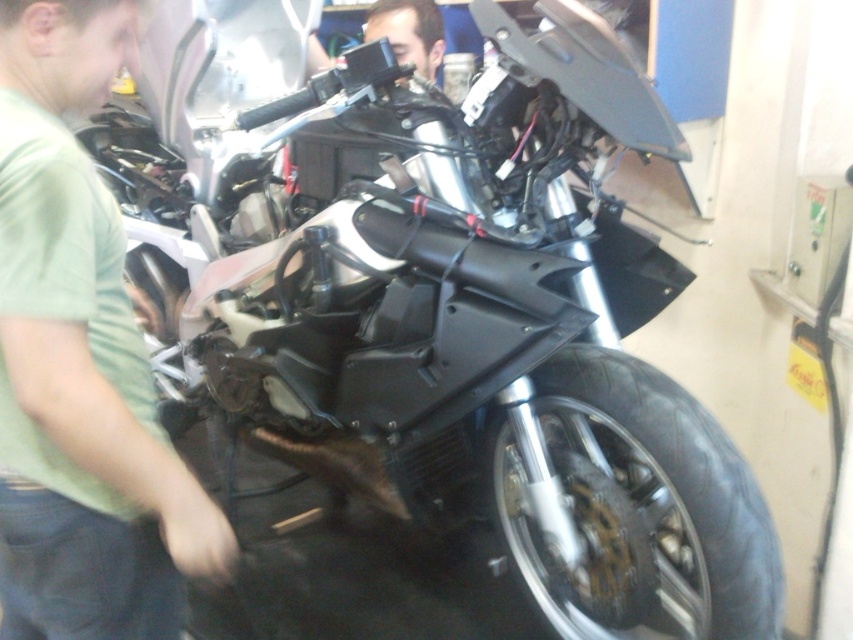
Question: Which object is the closest to the matte black camera at upper center?

Choices:
 (A) black rubber tire at lower right
 (B) green matte shirt at left

Answer: (A)

Question: Which object is the farthest from the green matte shirt at left?

Choices:
 (A) black rubber tire at lower right
 (B) matte black camera at upper center

Answer: (B)

Question: Considering the relative positions of black rubber tire at lower right and matte black camera at upper center in the image provided, where is black rubber tire at lower right located with respect to matte black camera at upper center?

Choices:
 (A) below
 (B) above

Answer: (A)

Question: Which object is the farthest from the matte black camera at upper center?

Choices:
 (A) green matte shirt at left
 (B) black rubber tire at lower right

Answer: (A)

Question: Is black rubber tire at lower right smaller than matte black camera at upper center?

Choices:
 (A) no
 (B) yes

Answer: (A)

Question: Does green matte shirt at left appear on the right side of black rubber tire at lower right?

Choices:
 (A) yes
 (B) no

Answer: (B)